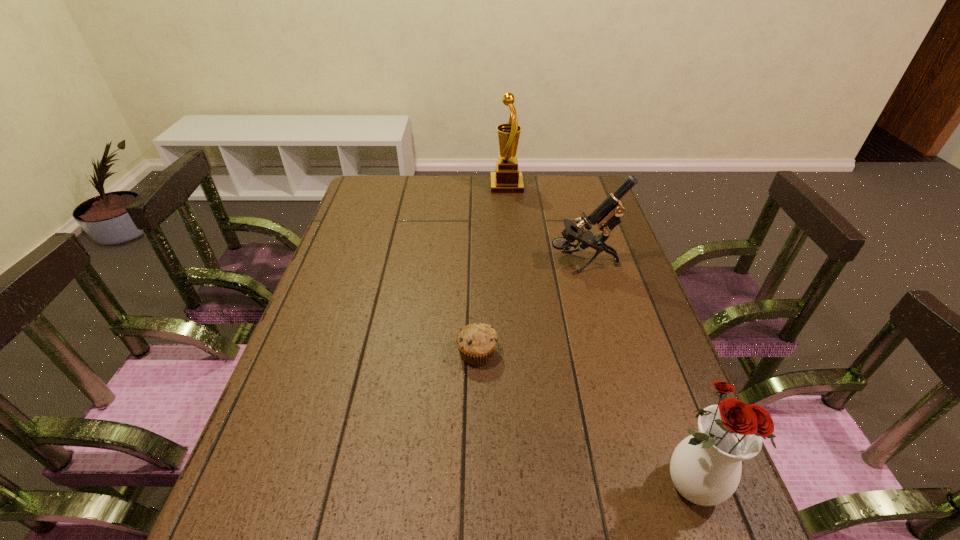
Locate an element on the screen. This screenshot has width=960, height=540. vacant space at the far left corner is located at coordinates click(390, 187).

In the image, there is a desktop. Find the location of `blank space at the far right corner`. blank space at the far right corner is located at coordinates (582, 185).

What are the coordinates of `vacant space that's between the vase and the second farthest object` in the screenshot? It's located at (636, 374).

Where is `vacant area that lies between the third nearest object and the second nearest object`? vacant area that lies between the third nearest object and the second nearest object is located at coordinates (530, 308).

I want to click on free space between the farthest object and the nearest object, so click(597, 336).

Locate an element on the screen. vacant area that lies between the second farthest object and the shortest object is located at coordinates (530, 308).

What are the coordinates of `free space between the microscope and the muffin` in the screenshot? It's located at (530, 308).

I want to click on free spot between the muffin and the microscope, so click(530, 308).

Locate an element on the screen. The height and width of the screenshot is (540, 960). vacant area that lies between the muffin and the tallest object is located at coordinates (492, 269).

Identify the location of free area in between the shortest object and the microscope. (530, 308).